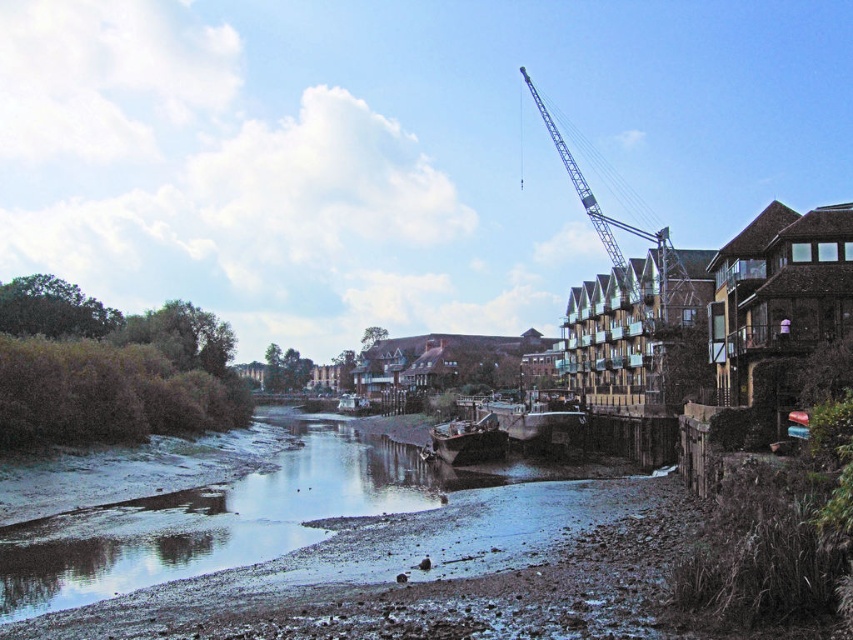
You are standing at the center of the image and want to walk towards the smooth mud at lower center. Which direction should you face to walk directly towards it?

You should face the lower center direction to walk directly towards the smooth mud at lower center, as it is located at point coordinates of (289, 516).

You are standing at the point marked by the coordinates point (289, 516) in the riverside scene. Based on the description, what type of terrain would you expect to find under your feet?

The point (289, 516) indicates smooth mud at lower center, so you would expect to find smooth mud under your feet.